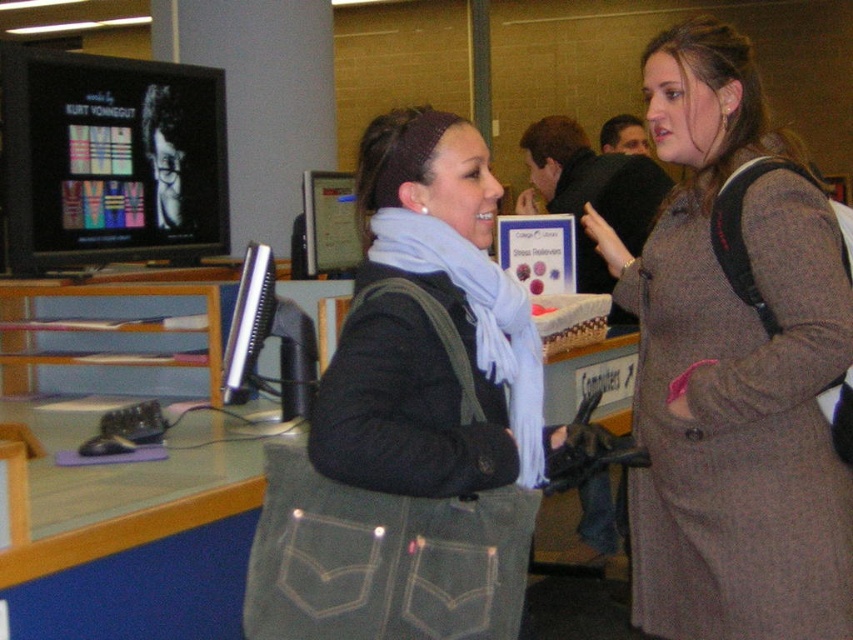
Who is higher up, gray wool coat at center or matte black monitor at upper left?

matte black monitor at upper left

Who is taller, gray wool coat at center or matte black monitor at upper left?

Standing taller between the two is gray wool coat at center.

The image size is (853, 640). What do you see at coordinates (735, 364) in the screenshot?
I see `gray wool coat at center` at bounding box center [735, 364].

Identify the location of gray wool coat at center. (735, 364).

Does matte black jacket at center lie in front of matte black monitor at upper left?

Yes, matte black jacket at center is closer to the viewer.

Between point (440, 598) and point (108, 122), which one is positioned in front?

Point (440, 598)

Image resolution: width=853 pixels, height=640 pixels. What are the coordinates of `matte black jacket at center` in the screenshot? It's located at (415, 417).

Which is more to the right, gray wool coat at center or matte black jacket at center?

From the viewer's perspective, gray wool coat at center appears more on the right side.

What do you see at coordinates (735, 364) in the screenshot? This screenshot has width=853, height=640. I see `gray wool coat at center` at bounding box center [735, 364].

The image size is (853, 640). Find the location of `gray wool coat at center`. gray wool coat at center is located at coordinates (735, 364).